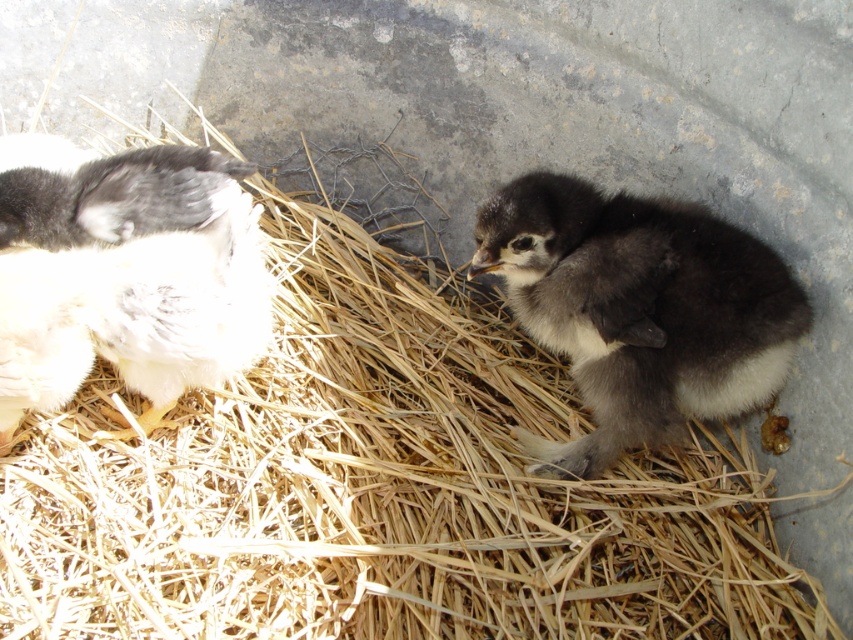
Looking at this image, does white fluffy chicken at left have a lesser height compared to dark gray fluffy chick at center?

Indeed, white fluffy chicken at left has a lesser height compared to dark gray fluffy chick at center.

What do you see at coordinates (125, 273) in the screenshot? The image size is (853, 640). I see `white fluffy chicken at left` at bounding box center [125, 273].

Between point (45, 310) and point (590, 349), which one is positioned in front?

Point (45, 310) is more forward.

Identify the location of white fluffy chicken at left. (125, 273).